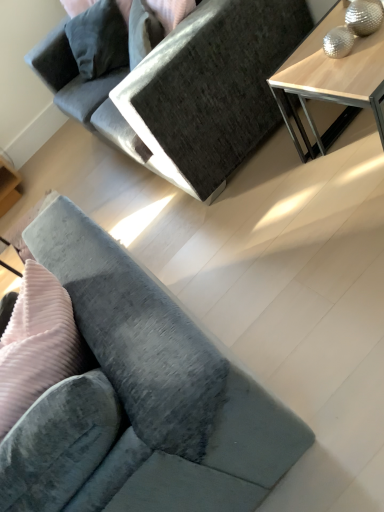
Question: Can you confirm if light wood table at upper right is taller than velvet grey couch at lower left, which is the first studio couch in bottom-to-top order?

Choices:
 (A) yes
 (B) no

Answer: (B)

Question: Is light wood table at upper right to the right of velvet grey couch at lower left, marked as the 2th studio couch in a top-to-bottom arrangement, from the viewer's perspective?

Choices:
 (A) yes
 (B) no

Answer: (A)

Question: From the image's perspective, would you say light wood table at upper right is shown under velvet grey couch at lower left, which is the first studio couch in bottom-to-top order?

Choices:
 (A) yes
 (B) no

Answer: (B)

Question: Are light wood table at upper right and velvet grey couch at lower left, marked as the 2th studio couch in a top-to-bottom arrangement, making contact?

Choices:
 (A) no
 (B) yes

Answer: (A)

Question: From a real-world perspective, is light wood table at upper right on top of velvet grey couch at lower left, marked as the 2th studio couch in a top-to-bottom arrangement?

Choices:
 (A) no
 (B) yes

Answer: (A)

Question: Can you confirm if light wood table at upper right is bigger than velvet grey couch at lower left, marked as the 2th studio couch in a top-to-bottom arrangement?

Choices:
 (A) no
 (B) yes

Answer: (A)

Question: Does velvet gray couch at center, the 1th studio couch positioned from the top, have a greater height compared to light wood table at upper right?

Choices:
 (A) no
 (B) yes

Answer: (B)

Question: Is velvet gray couch at center, the 2th studio couch from the bottom, thinner than light wood table at upper right?

Choices:
 (A) no
 (B) yes

Answer: (A)

Question: Is velvet gray couch at center, the 1th studio couch positioned from the top, not within light wood table at upper right?

Choices:
 (A) no
 (B) yes

Answer: (B)

Question: Could light wood table at upper right be considered to be inside velvet gray couch at center, the 2th studio couch from the bottom?

Choices:
 (A) no
 (B) yes

Answer: (A)

Question: From a real-world perspective, is velvet gray couch at center, the 2th studio couch from the bottom, on top of light wood table at upper right?

Choices:
 (A) yes
 (B) no

Answer: (A)

Question: Is velvet gray couch at center, the 1th studio couch positioned from the top, not close to light wood table at upper right?

Choices:
 (A) no
 (B) yes

Answer: (A)

Question: From the image's perspective, is velvet gray couch at center, the 1th studio couch positioned from the top, on velvet grey couch at lower left, which is the first studio couch in bottom-to-top order?

Choices:
 (A) no
 (B) yes

Answer: (B)